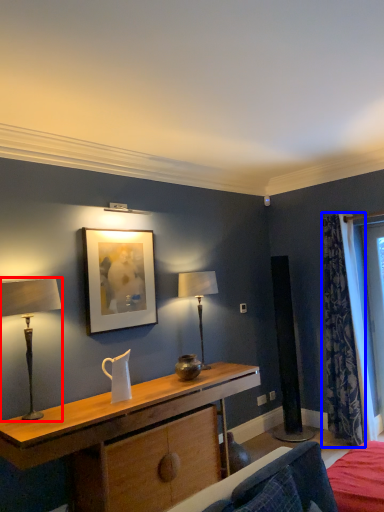
Question: Which object appears farthest to the camera in this image, table lamp (highlighted by a red box) or curtain (highlighted by a blue box)?

Choices:
 (A) table lamp
 (B) curtain

Answer: (B)